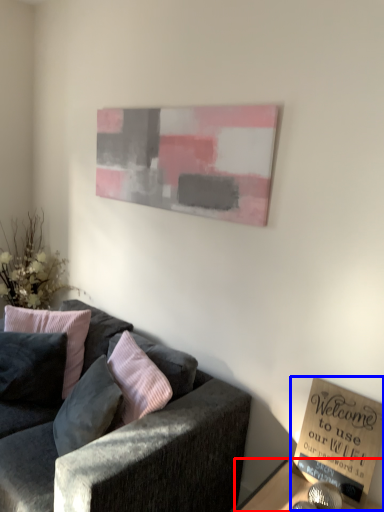
Question: Which of the following is the farthest to the observer, table (highlighted by a red box) or book (highlighted by a blue box)?

Choices:
 (A) table
 (B) book

Answer: (B)